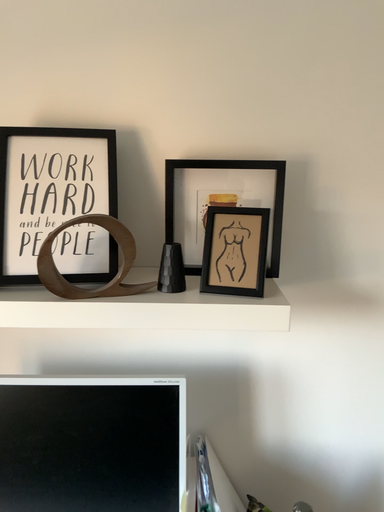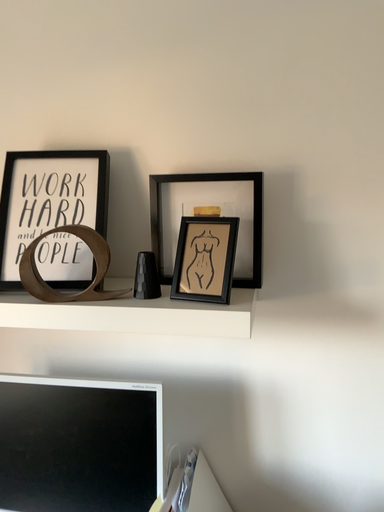
Question: Which way did the camera rotate in the video?

Choices:
 (A) rotated left
 (B) rotated right

Answer: (A)